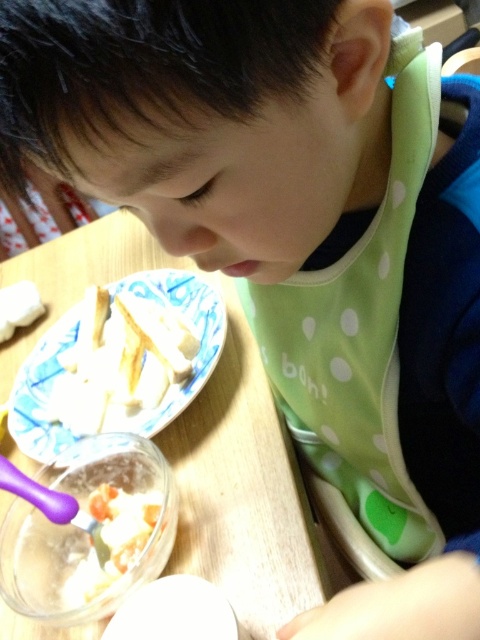
Between green dotted bib at center and white glossy plate at center, which one is positioned lower?

white glossy plate at center is lower down.

Does green dotted bib at center appear under white glossy plate at center?

Actually, green dotted bib at center is above white glossy plate at center.

Is point (396, 552) less distant than point (132, 289)?

That is True.

Locate an element on the screen. This screenshot has width=480, height=640. green dotted bib at center is located at coordinates (359, 337).

Between wooden table at center and white creamy food at center, which one is positioned lower?

white creamy food at center is below.

Is wooden table at center above white creamy food at center?

Correct, wooden table at center is located above white creamy food at center.

Who is more distant from viewer, (218, 369) or (156, 500)?

Positioned behind is point (218, 369).

Where is `wooden table at center`? Image resolution: width=480 pixels, height=640 pixels. wooden table at center is located at coordinates (243, 492).

Can you confirm if green dotted bib at center is shorter than white creamy food at center?

Incorrect, green dotted bib at center's height does not fall short of white creamy food at center's.

Between point (403, 305) and point (155, 518), which one is positioned in front?

Point (403, 305)

Locate an element on the screen. green dotted bib at center is located at coordinates (359, 337).